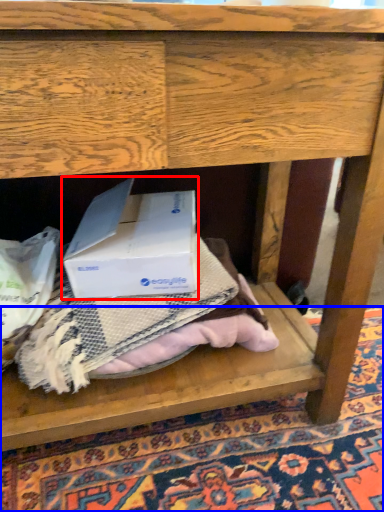
Question: Which object is further to the camera taking this photo, box (highlighted by a red box) or mat (highlighted by a blue box)?

Choices:
 (A) box
 (B) mat

Answer: (A)